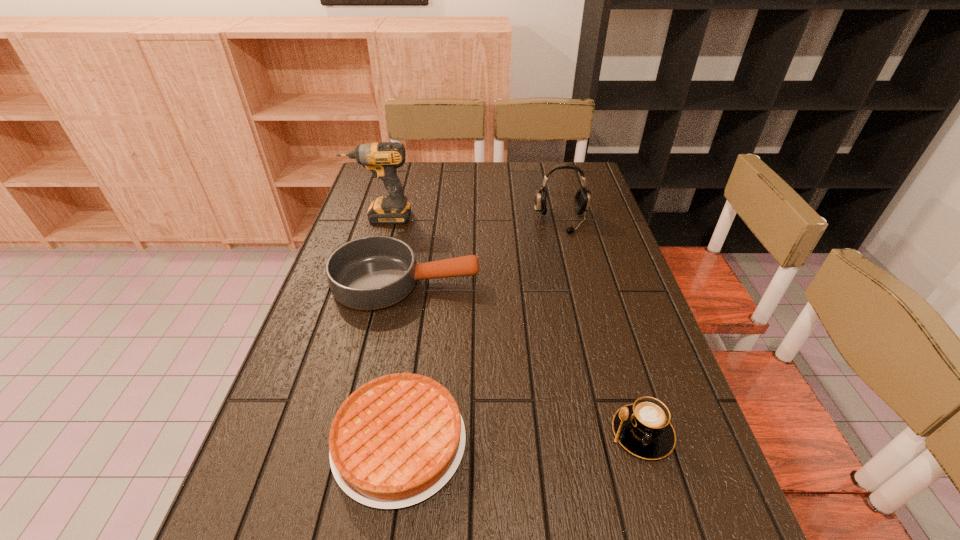
This screenshot has width=960, height=540. Identify the location of vacant region between the shortest object and the cappuccino. (520, 437).

Where is `free spot between the cappuccino and the shortest object`? The image size is (960, 540). free spot between the cappuccino and the shortest object is located at coordinates (520, 437).

Find the location of `vacant space that's between the pan and the pie`. vacant space that's between the pan and the pie is located at coordinates (403, 362).

Image resolution: width=960 pixels, height=540 pixels. I want to click on unoccupied position between the cappuccino and the shortest object, so click(x=520, y=437).

Locate an element on the screen. unoccupied area between the headset and the drill is located at coordinates (471, 219).

Locate an element on the screen. The image size is (960, 540). free space between the cappuccino and the fourth shortest object is located at coordinates (602, 327).

Where is `blank region between the pie and the tallest object`? blank region between the pie and the tallest object is located at coordinates (390, 329).

The image size is (960, 540). What are the coordinates of `vacant area that lies between the pie and the third farthest object` in the screenshot? It's located at (403, 362).

Where is `object identified as the second closest to the drill`? The height and width of the screenshot is (540, 960). object identified as the second closest to the drill is located at coordinates (582, 198).

Locate an element on the screen. The image size is (960, 540). the second closest object relative to the third farthest object is located at coordinates (582, 198).